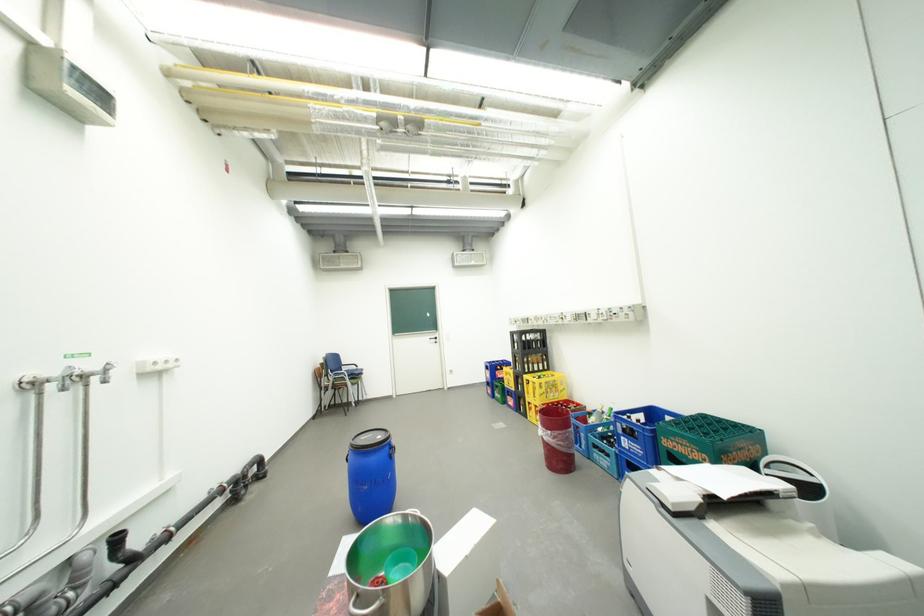
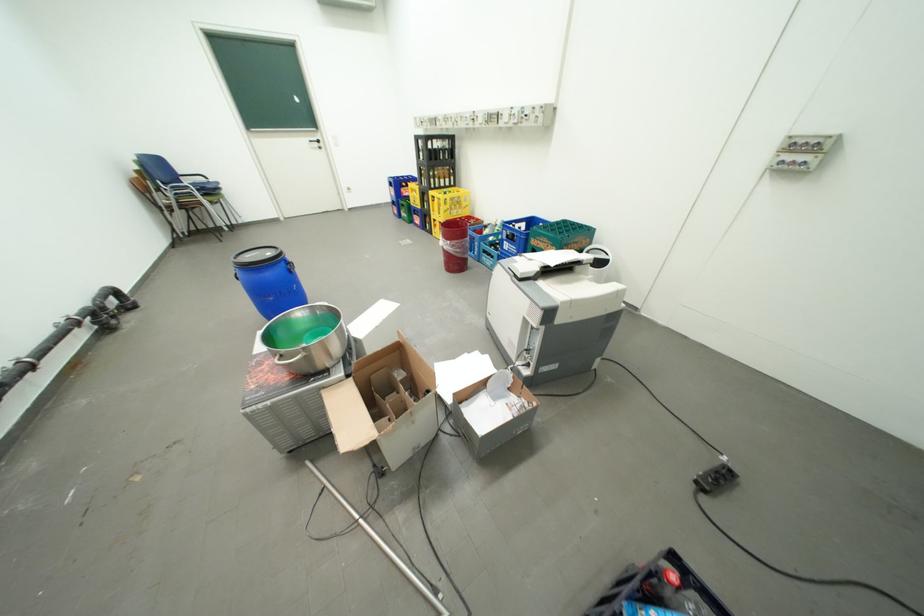
The point at (525,349) is marked in the first image. Where is the corresponding point in the second image?

(430, 159)